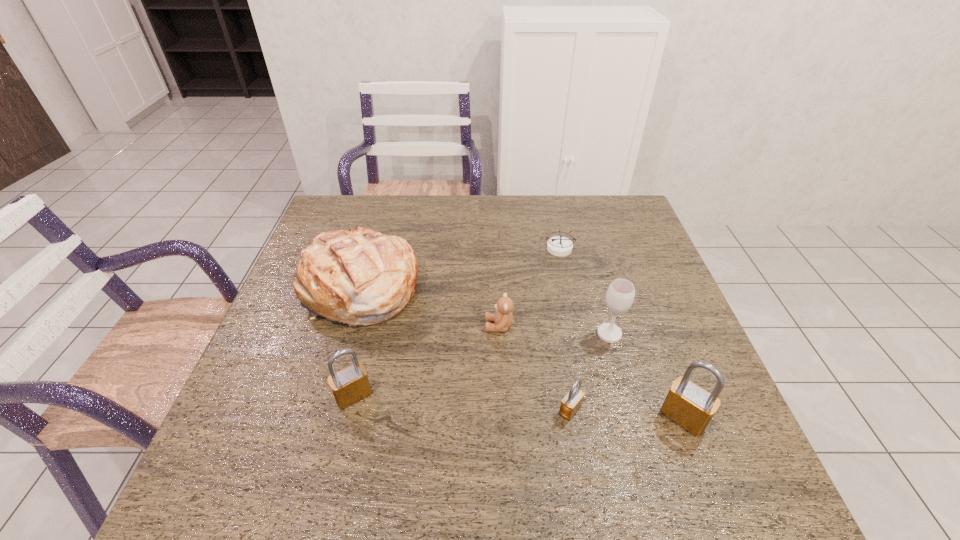
The image size is (960, 540). Identify the location of vacant space located 0.080m on the right of the shortest object. (601, 248).

At what (x,y) coordinates should I click in order to perform the action: click on vacant area situated 0.090m on the front of the second object from right to left. Please return your answer as a coordinate pair (x, y). This screenshot has height=540, width=960. Looking at the image, I should click on (621, 374).

This screenshot has height=540, width=960. I want to click on vacant area located 0.060m on the back of the bread, so click(x=371, y=244).

I want to click on vacant space situated on the face of the teddy bear, so click(429, 326).

Where is `blank area located 0.230m on the face of the teddy bear`? blank area located 0.230m on the face of the teddy bear is located at coordinates [393, 326].

Locate an element on the screen. free location located on the face of the teddy bear is located at coordinates (328, 326).

You are a GUI agent. You are given a task and a screenshot of the screen. Output one action in this format:
    pyautogui.click(x=<x>, y=<y>)
    Task: Click on the object present at the left edge
    Image resolution: width=960 pixels, height=540 pixels.
    Given the screenshot: What is the action you would take?
    pyautogui.click(x=361, y=277)

What are the coordinates of `object present at the right edge` in the screenshot? It's located at (687, 404).

Locate an element on the screen. This screenshot has height=540, width=960. object that is at the near right corner is located at coordinates (687, 404).

Where is `free region at the far edge`? This screenshot has height=540, width=960. free region at the far edge is located at coordinates (463, 232).